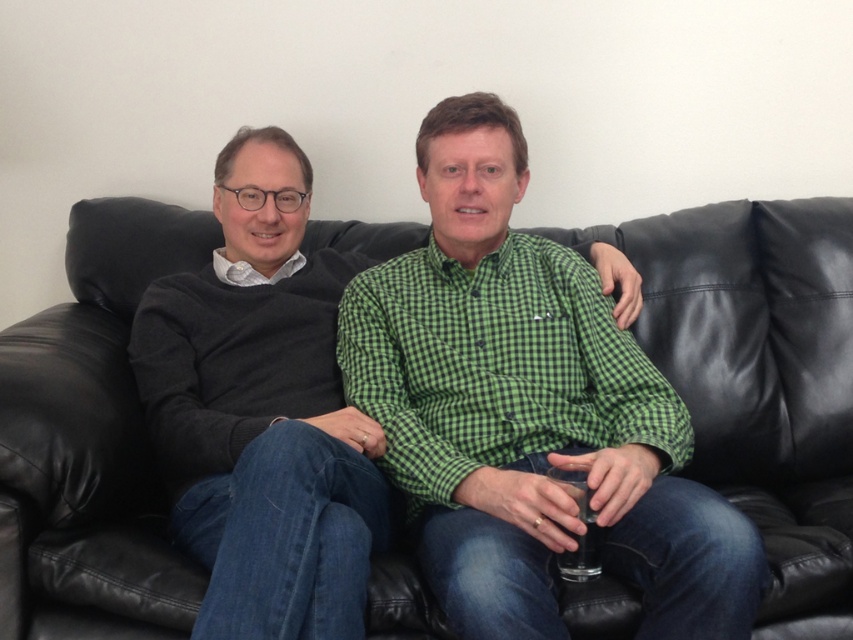
Between black leather couch at center and white matte shirt at left, which one has less height?

white matte shirt at left is shorter.

Does black leather couch at center have a smaller size compared to white matte shirt at left?

Actually, black leather couch at center might be larger than white matte shirt at left.

Does point (640, 339) come in front of point (293, 253)?

No, it is behind (293, 253).

Identify the location of black leather couch at center. (761, 376).

Between green checkered shirt at center and white matte shirt at left, which one appears on the left side from the viewer's perspective?

white matte shirt at left is more to the left.

Does point (422, 497) come closer to viewer compared to point (279, 273)?

Yes, it is.

At what (x,y) coordinates should I click in order to perform the action: click on green checkered shirt at center. Please return your answer as a coordinate pair (x, y). Image resolution: width=853 pixels, height=640 pixels. Looking at the image, I should click on (529, 410).

From the picture: Is black leather couch at center to the right of dark gray sweater at left from the viewer's perspective?

No, black leather couch at center is not to the right of dark gray sweater at left.

This screenshot has width=853, height=640. I want to click on black leather couch at center, so click(761, 376).

Find the location of a particular element. This screenshot has height=640, width=853. black leather couch at center is located at coordinates (761, 376).